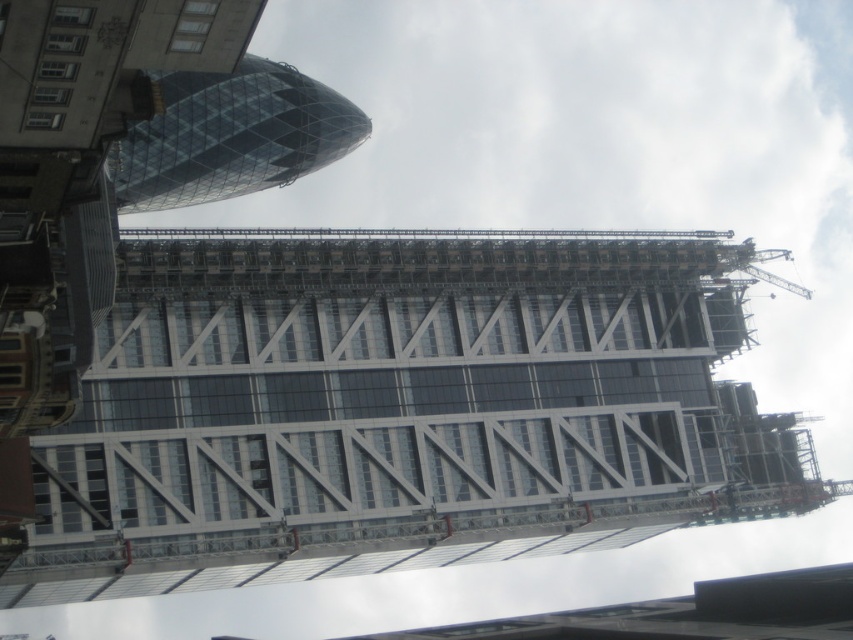
Question: Which object appears farthest from the camera in this image?

Choices:
 (A) transparent glass tower at upper left
 (B) transparent glass building at center

Answer: (B)

Question: Can you confirm if transparent glass building at center is thinner than transparent glass tower at upper left?

Choices:
 (A) no
 (B) yes

Answer: (A)

Question: Is transparent glass building at center bigger than transparent glass tower at upper left?

Choices:
 (A) yes
 (B) no

Answer: (A)

Question: Is transparent glass building at center smaller than transparent glass tower at upper left?

Choices:
 (A) no
 (B) yes

Answer: (A)

Question: Among these points, which one is farthest from the camera?

Choices:
 (A) (160, 180)
 (B) (674, 352)

Answer: (A)

Question: Among these objects, which one is nearest to the camera?

Choices:
 (A) transparent glass tower at upper left
 (B) transparent glass building at center

Answer: (A)